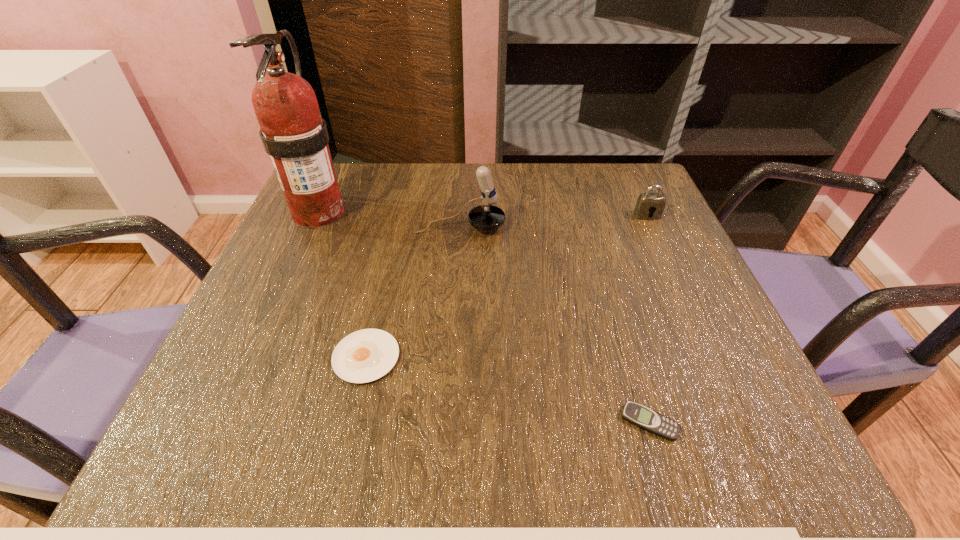
I want to click on object at the far left corner, so click(293, 133).

This screenshot has height=540, width=960. Find the location of `object positioned at the far right corner`. object positioned at the far right corner is located at coordinates tap(647, 203).

The image size is (960, 540). Identify the location of object that is positioned at the near right corner. (645, 418).

The image size is (960, 540). Find the location of `free location at the far edge`. free location at the far edge is located at coordinates (372, 218).

This screenshot has height=540, width=960. I want to click on vacant area at the near edge of the desktop, so click(622, 411).

At what (x,y) coordinates should I click in order to perform the action: click on vacant space at the left edge of the desktop. Please return your answer as a coordinate pair (x, y). Looking at the image, I should click on (335, 262).

Locate an element on the screen. This screenshot has width=960, height=540. vacant area at the right edge of the desktop is located at coordinates (710, 294).

Identify the location of vacant point at the near left corner. (279, 433).

Locate an element on the screen. The image size is (960, 540). free location at the far right corner is located at coordinates (587, 178).

Image resolution: width=960 pixels, height=540 pixels. I want to click on unoccupied area between the egg yolk and the nearest object, so click(508, 389).